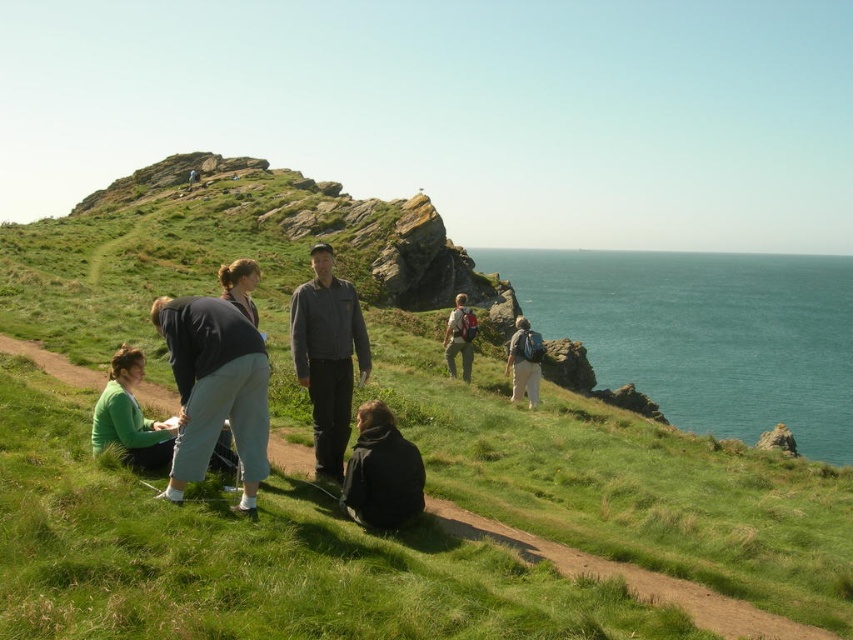
Question: Which is nearer to the dark brown jacket at lower center?

Choices:
 (A) dark blue fabric jacket at lower left
 (B) matte gray backpack at center
 (C) light gray backpack at center

Answer: (A)

Question: Which object appears farthest from the camera in this image?

Choices:
 (A) dark blue jacket at center
 (B) dark blue fabric jacket at lower left
 (C) dark gray jacket at center
 (D) matte gray backpack at center

Answer: (D)

Question: Can you confirm if green sweater at lower left is positioned above matte gray backpack at center?

Choices:
 (A) yes
 (B) no

Answer: (B)

Question: Can you confirm if dark gray jacket at center is positioned to the left of matte gray backpack at center?

Choices:
 (A) yes
 (B) no

Answer: (A)

Question: Can you confirm if dark gray jacket at center is smaller than dark brown jacket at lower center?

Choices:
 (A) yes
 (B) no

Answer: (B)

Question: Which of the following is the closest to the observer?

Choices:
 (A) (740, 276)
 (B) (144, 429)
 (C) (344, 492)

Answer: (C)